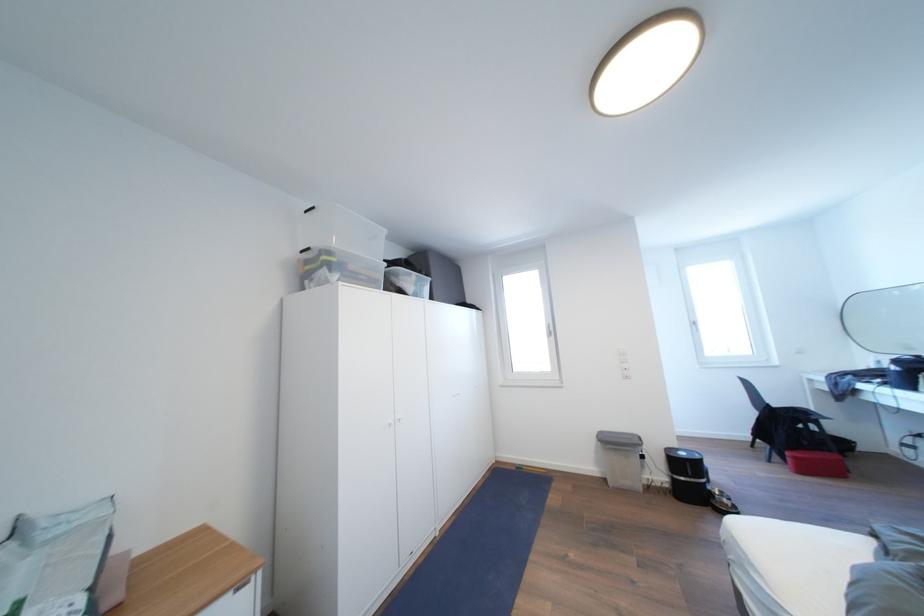
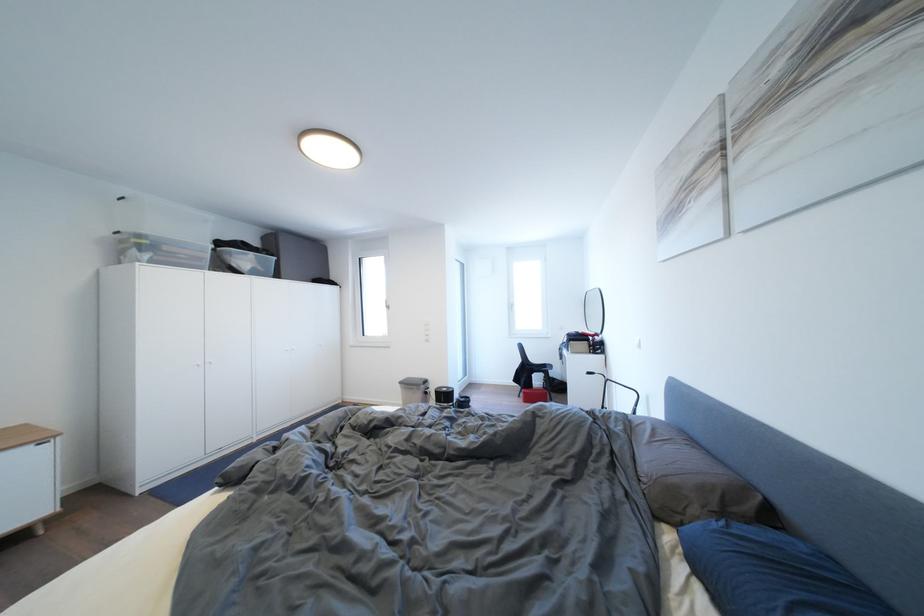
Which direction would the cameraman need to move to produce the second image?

The cameraman walked toward right, backward.